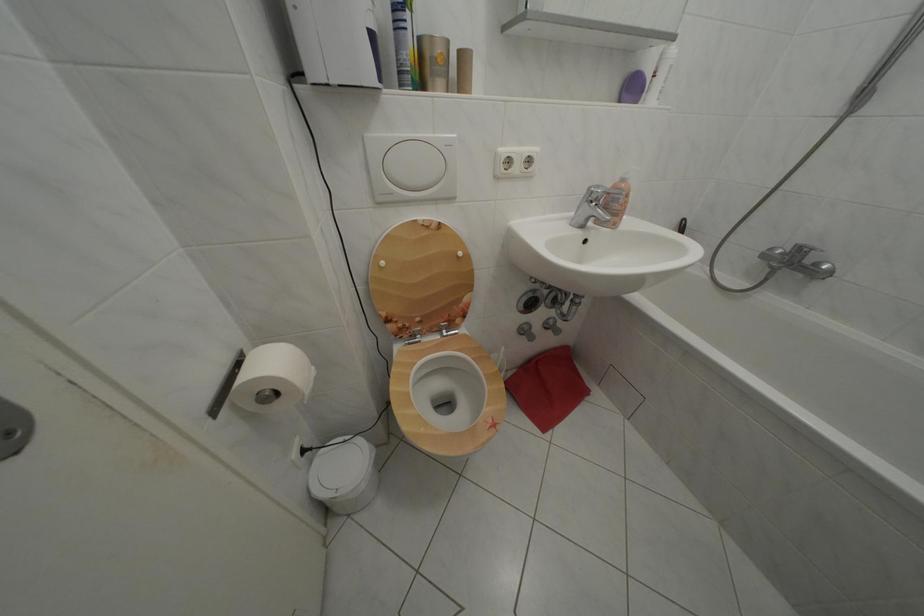
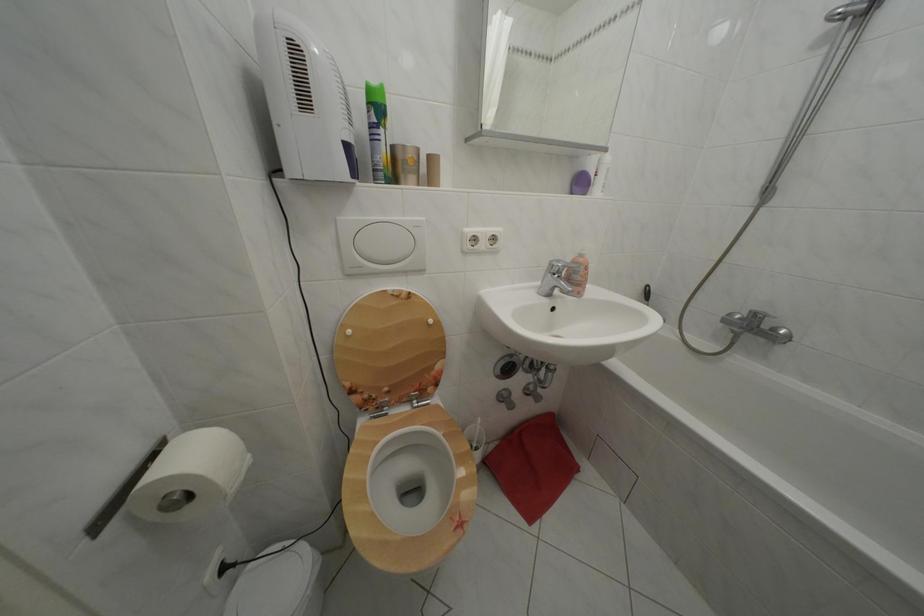
Find the pixel in the second image that matches (x=375, y=142) in the first image.

(348, 225)